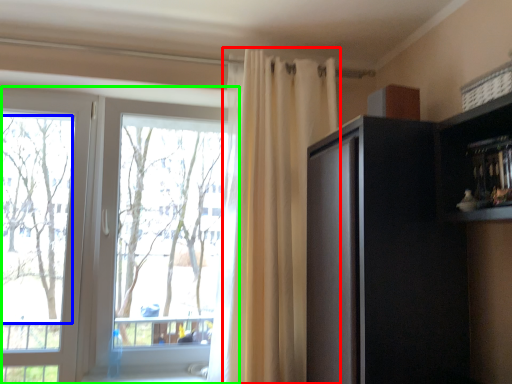
Question: Considering the real-world distances, which object is closest to curtain (highlighted by a red box)? tree (highlighted by a blue box) or window (highlighted by a green box).

Choices:
 (A) tree
 (B) window

Answer: (B)